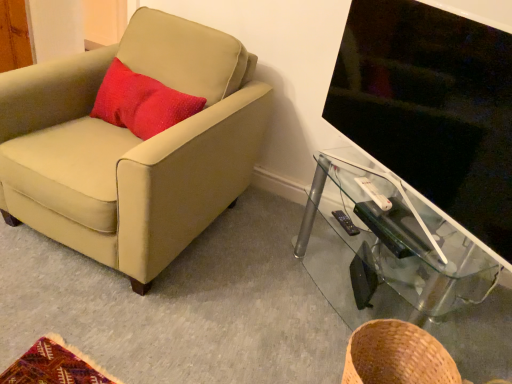
Question: From a real-world perspective, is brown woven basket at lower right positioned above or below black glossy tv at right?

Choices:
 (A) below
 (B) above

Answer: (A)

Question: In the image, is brown woven basket at lower right positioned in front of or behind black glossy tv at right?

Choices:
 (A) front
 (B) behind

Answer: (B)

Question: Based on their relative distances, which object is farther from the brown woven basket at lower right?

Choices:
 (A) white plastic remote control at right, marked as the second remote control in a back-to-front arrangement
 (B) beige fabric chair at left
 (C) black plastic remote control at lower right, which is the 2th remote control from front to back
 (D) black glossy tv at right
 (E) transparent glass tv stand at right

Answer: (B)

Question: Which is nearer to the beige fabric chair at left?

Choices:
 (A) black glossy tv at right
 (B) transparent glass tv stand at right
 (C) white plastic remote control at right, marked as the second remote control in a back-to-front arrangement
 (D) black plastic remote control at lower right, which is the 2th remote control from front to back
 (E) brown woven basket at lower right

Answer: (A)